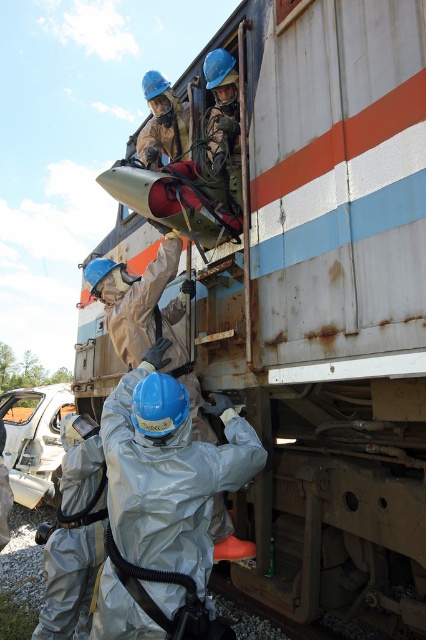
Which of these two, silver reflective suit at lower center or matte blue helmet at upper center, stands taller?

silver reflective suit at lower center

The image size is (426, 640). Describe the element at coordinates (161, 496) in the screenshot. I see `silver reflective suit at lower center` at that location.

Which is in front, point (132, 609) or point (169, 84)?

Point (132, 609)

This screenshot has width=426, height=640. Find the location of `silver reflective suit at lower center`. silver reflective suit at lower center is located at coordinates (161, 496).

Which is more to the right, silver reflective suit at lower center or matte black helmet at upper center?

Positioned to the right is matte black helmet at upper center.

Measure the distance between silver reflective suit at lower center and matte black helmet at upper center.

silver reflective suit at lower center and matte black helmet at upper center are 1.95 meters apart from each other.

Which is in front, point (121, 516) or point (233, 156)?

Point (121, 516) is more forward.

You are a GUI agent. You are given a task and a screenshot of the screen. Output one action in this format:
    pyautogui.click(x=<x>, y=<y>)
    Task: Click on the silver reflective suit at lower center
    
    Given the screenshot: What is the action you would take?
    pyautogui.click(x=161, y=496)

Does matte black helmet at upper center appear on the left side of matte blue helmet at upper center?

No, matte black helmet at upper center is not to the left of matte blue helmet at upper center.

Is matte black helmet at upper center below matte blue helmet at upper center?

Yes, matte black helmet at upper center is below matte blue helmet at upper center.

Find the location of `matte black helmet at upper center`. matte black helmet at upper center is located at coordinates (221, 109).